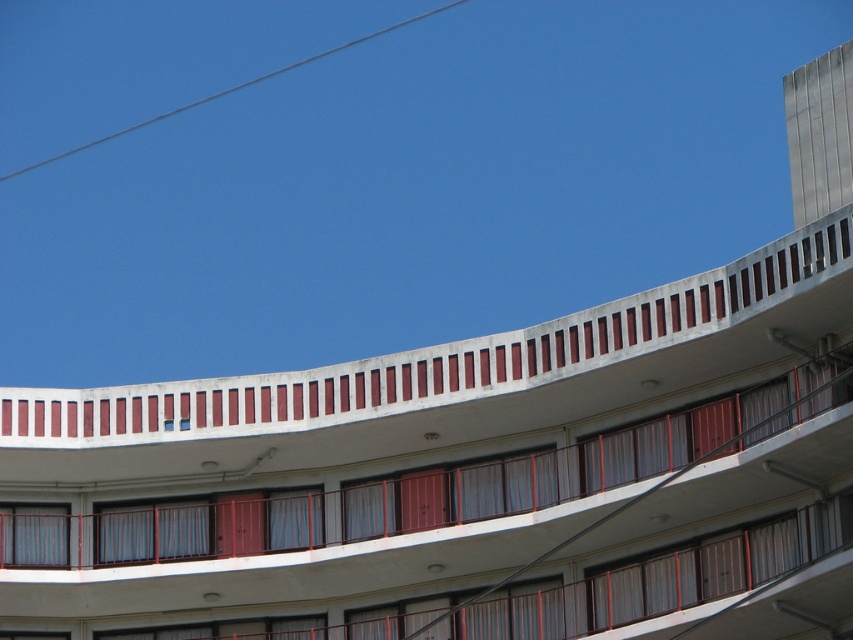
You are a window washer standing on the white concrete balcony at upper center and need to reach the gray wire at upper left. Can you safely reach it from your current position without needing a ladder?

The white concrete balcony at upper center has a lesser height compared to gray wire at upper left, so you cannot safely reach it without a ladder since the gray wire at upper left is higher up.

You are a maintenance worker needing to reach both the white concrete balcony at upper center and the gray wire at upper left. Given that your ladder can only extend up to 180 meters, will you be able to safely reach both locations with a single ladder?

The distance between the white concrete balcony at upper center and the gray wire at upper left is 183.13 meters. Since your ladder can only extend up to 180 meters, you will not be able to safely reach both locations with a single ladder.